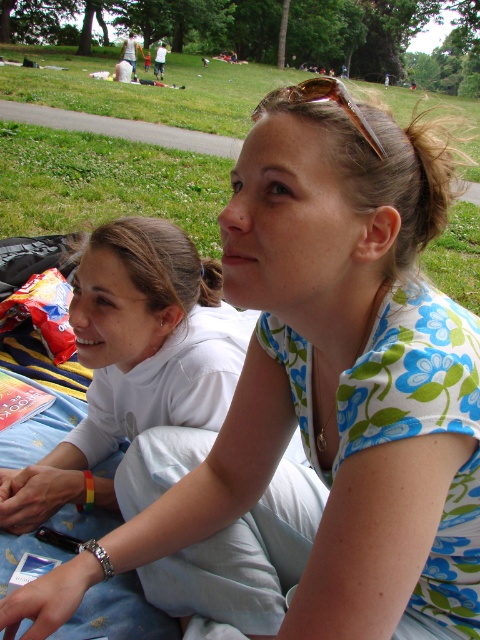
Can you confirm if green grass at upper center is positioned above gold metallic sunglasses at upper center?

Indeed, green grass at upper center is positioned over gold metallic sunglasses at upper center.

Locate an element on the screen. green grass at upper center is located at coordinates (106, 186).

Is point (204, 196) farther from camera compared to point (338, 90)?

Yes, point (204, 196) is farther from viewer.

Where is `green grass at upper center`? green grass at upper center is located at coordinates (106, 186).